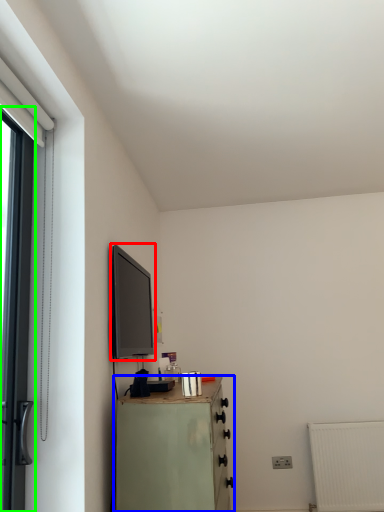
Question: Estimate the real-world distances between objects in this image. Which object is farther from window screen (highlighted by a red box), chest of drawers (highlighted by a blue box) or door (highlighted by a green box)?

Choices:
 (A) chest of drawers
 (B) door

Answer: (B)